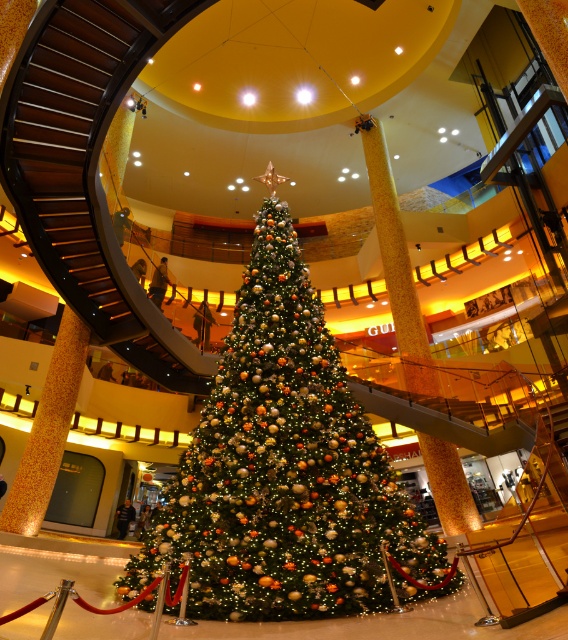
Who is more forward, (298,480) or (73,216)?

Point (298,480) is more forward.

Who is more forward, (x=265, y=371) or (x=69, y=93)?

Point (x=265, y=371) is more forward.

Locate an element on the screen. This screenshot has height=640, width=568. shiny metallic christmas tree at center is located at coordinates (285, 467).